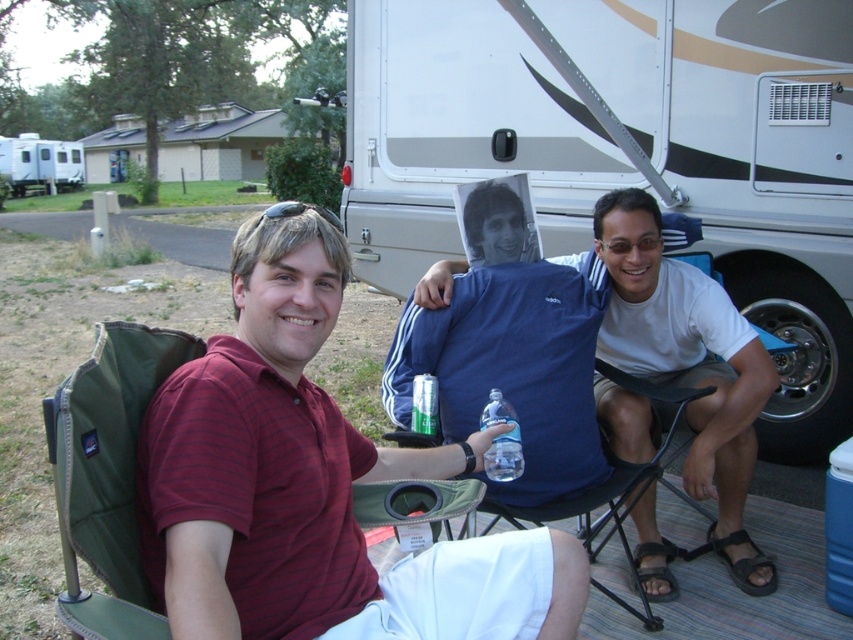
Consider the image. You are a photographer trying to capture a closeup of the maroon striped shirt at center and the brown leather sandal at lower right. Which object will appear bigger in your photo?

The maroon striped shirt at center will appear bigger in the photo because it is larger in size than the brown leather sandal at lower right.

You are a photographer trying to capture a group photo of the maroon striped shirt at center and the brown leather sandal at lower right. Since you want to ensure both subjects are clearly visible, which one should you focus on first to account for their sizes?

The maroon striped shirt at center has a larger width than the brown leather sandal at lower right, so you should focus on the maroon striped shirt at center first to ensure its details are sharp before adjusting for the smaller sandal.